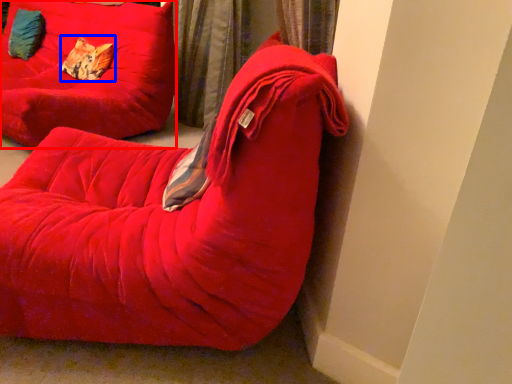
Question: Which of the following is the farthest to the observer, furniture (highlighted by a red box) or pillow (highlighted by a blue box)?

Choices:
 (A) furniture
 (B) pillow

Answer: (B)